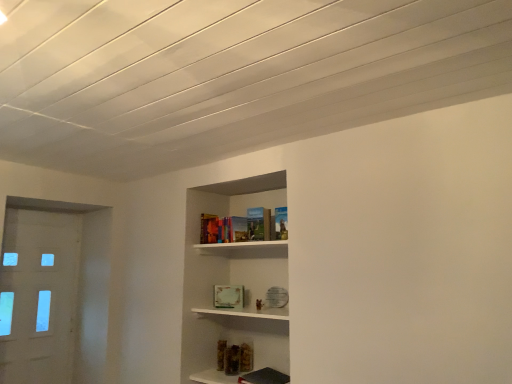
Describe the element at coordinates (238, 228) in the screenshot. I see `matte hardcover book at center` at that location.

Where is `matte hardcover book at center`? The width and height of the screenshot is (512, 384). matte hardcover book at center is located at coordinates (238, 228).

This screenshot has height=384, width=512. Describe the element at coordinates (38, 296) in the screenshot. I see `white glossy door at left` at that location.

Find the location of a particular element. This screenshot has width=512, height=384. white glossy door at left is located at coordinates (38, 296).

Find the location of a particular element. matte hardcover book at center is located at coordinates (238, 228).

Considering the relative positions of white glossy door at left and matte hardcover book at center in the image provided, is white glossy door at left to the left of matte hardcover book at center from the viewer's perspective?

Indeed, white glossy door at left is positioned on the left side of matte hardcover book at center.

Is white glossy door at left further to the viewer compared to matte hardcover book at center?

Yes, white glossy door at left is behind matte hardcover book at center.

Is point (19, 310) positioned in front of point (212, 220)?

No, it is behind (212, 220).

From the image's perspective, who appears lower, white glossy door at left or matte hardcover book at center?

white glossy door at left, from the image's perspective.

From a real-world perspective, who is located lower, white glossy door at left or matte hardcover book at center?

white glossy door at left, from a real-world perspective.

Can you confirm if white glossy door at left is wider than matte hardcover book at center?

No.

Between white glossy door at left and matte hardcover book at center, which one has less height?

matte hardcover book at center is shorter.

Can you confirm if white glossy door at left is smaller than matte hardcover book at center?

Incorrect, white glossy door at left is not smaller in size than matte hardcover book at center.

Looking at this image, is white glossy door at left completely or partially outside of matte hardcover book at center?

white glossy door at left is positioned outside matte hardcover book at center.

Would you say white glossy door at left is a long distance from matte hardcover book at center?

white glossy door at left is far away from matte hardcover book at center.

Is white glossy door at left looking in the opposite direction of matte hardcover book at center?

white glossy door at left does not have its back to matte hardcover book at center.

Can you tell me how much white glossy door at left and matte hardcover book at center differ in facing direction?

89 degrees separate the facing orientations of white glossy door at left and matte hardcover book at center.

Image resolution: width=512 pixels, height=384 pixels. What are the coordinates of `book on the right of white glossy door at left` in the screenshot? It's located at (238, 228).

Is matte hardcover book at center at the right side of white glossy door at left?

Yes, matte hardcover book at center is to the right of white glossy door at left.

Considering the positions of objects matte hardcover book at center and white glossy door at left in the image provided, who is behind, matte hardcover book at center or white glossy door at left?

white glossy door at left is more distant.

Which is farther from the camera, (229, 234) or (59, 238)?

The point (59, 238) is farther from the camera.

From the image's perspective, does matte hardcover book at center appear lower than white glossy door at left?

Actually, matte hardcover book at center appears above white glossy door at left in the image.

From a real-world perspective, between matte hardcover book at center and white glossy door at left, who is vertically lower?

white glossy door at left, from a real-world perspective.

Which object is thinner, matte hardcover book at center or white glossy door at left?

white glossy door at left.

From the picture: Is matte hardcover book at center shorter than white glossy door at left?

Yes.

Between matte hardcover book at center and white glossy door at left, which one has smaller size?

matte hardcover book at center.

Is matte hardcover book at center not inside white glossy door at left?

Yes, matte hardcover book at center is not within white glossy door at left.

Is matte hardcover book at center far away from white glossy door at left?

Yes, matte hardcover book at center and white glossy door at left are located far from each other.

Could you tell me if matte hardcover book at center is facing white glossy door at left?

No, matte hardcover book at center is not aimed at white glossy door at left.

Locate an element on the screen. door located on the left of matte hardcover book at center is located at coordinates (38, 296).

You are a GUI agent. You are given a task and a screenshot of the screen. Output one action in this format:
    pyautogui.click(x=<x>, y=<y>)
    Task: Click on the book above the white glossy door at left (from the image's perspective)
    The image size is (512, 384).
    Given the screenshot: What is the action you would take?
    pyautogui.click(x=238, y=228)

You are a GUI agent. You are given a task and a screenshot of the screen. Output one action in this format:
    pyautogui.click(x=<x>, y=<y>)
    Task: Click on the door below the matte hardcover book at center (from the image's perspective)
    This screenshot has height=384, width=512.
    Given the screenshot: What is the action you would take?
    pyautogui.click(x=38, y=296)